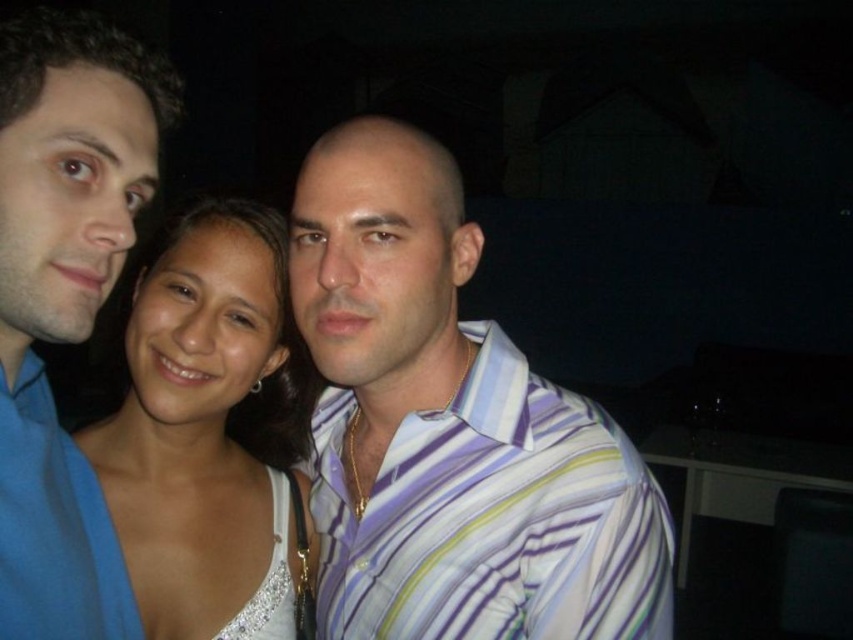
Does blue smooth shirt at left appear on the right side of white sequined dress at center?

No, blue smooth shirt at left is not to the right of white sequined dress at center.

Does blue smooth shirt at left appear over white sequined dress at center?

Correct, blue smooth shirt at left is located above white sequined dress at center.

Between point (86, 51) and point (274, 570), which one is positioned behind?

Positioned behind is point (274, 570).

Where is `blue smooth shirt at left`? This screenshot has height=640, width=853. blue smooth shirt at left is located at coordinates (62, 284).

Does striped cotton shirt at center appear on the right side of blue smooth shirt at left?

Yes, striped cotton shirt at center is to the right of blue smooth shirt at left.

Between point (668, 563) and point (13, 522), which one is positioned behind?

The point (668, 563) is behind.

Does point (401, 131) come behind point (109, 241)?

That is True.

At what (x,y) coordinates should I click in order to perform the action: click on striped cotton shirt at center. Please return your answer as a coordinate pair (x, y). Looking at the image, I should click on (451, 428).

Can you confirm if white satin dress at center is positioned above white sequined dress at center?

Yes, white satin dress at center is above white sequined dress at center.

Can you confirm if white satin dress at center is bigger than white sequined dress at center?

Indeed, white satin dress at center has a larger size compared to white sequined dress at center.

Find the location of a particular element. Image resolution: width=853 pixels, height=640 pixels. white satin dress at center is located at coordinates (212, 435).